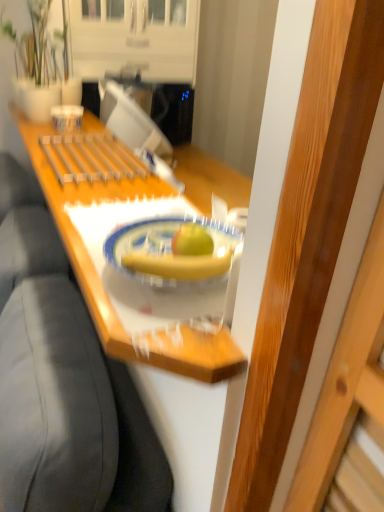
Question: From the image's perspective, would you say yellow matte banana at center is shown under porcelain plate at center?

Choices:
 (A) yes
 (B) no

Answer: (A)

Question: Is yellow matte banana at center in contact with porcelain plate at center?

Choices:
 (A) no
 (B) yes

Answer: (B)

Question: Does yellow matte banana at center have a larger size compared to porcelain plate at center?

Choices:
 (A) no
 (B) yes

Answer: (A)

Question: From the image's perspective, would you say yellow matte banana at center is positioned over porcelain plate at center?

Choices:
 (A) yes
 (B) no

Answer: (B)

Question: Could you tell me if yellow matte banana at center is facing porcelain plate at center?

Choices:
 (A) yes
 (B) no

Answer: (A)

Question: Is point (38, 157) closer or farther from the camera than point (195, 258)?

Choices:
 (A) farther
 (B) closer

Answer: (A)

Question: From the image's perspective, relative to porcelain plate at center, is wooden tray at center above or below?

Choices:
 (A) above
 (B) below

Answer: (B)

Question: Considering the positions of wooden tray at center and porcelain plate at center in the image, is wooden tray at center wider or thinner than porcelain plate at center?

Choices:
 (A) wide
 (B) thin

Answer: (A)

Question: From a real-world perspective, relative to porcelain plate at center, is wooden tray at center vertically above or below?

Choices:
 (A) above
 (B) below

Answer: (B)

Question: From a real-world perspective, is porcelain plate at center positioned above or below yellow matte banana at center?

Choices:
 (A) below
 (B) above

Answer: (A)

Question: From the image's perspective, is porcelain plate at center above or below yellow matte banana at center?

Choices:
 (A) below
 (B) above

Answer: (B)

Question: Is porcelain plate at center inside or outside of yellow matte banana at center?

Choices:
 (A) outside
 (B) inside

Answer: (A)

Question: From their relative heights in the image, would you say porcelain plate at center is taller or shorter than yellow matte banana at center?

Choices:
 (A) short
 (B) tall

Answer: (B)

Question: Considering the positions of wooden tray at center and matte white vase at upper left in the image, is wooden tray at center wider or thinner than matte white vase at upper left?

Choices:
 (A) wide
 (B) thin

Answer: (B)

Question: From a real-world perspective, is wooden tray at center physically located above or below matte white vase at upper left?

Choices:
 (A) below
 (B) above

Answer: (A)